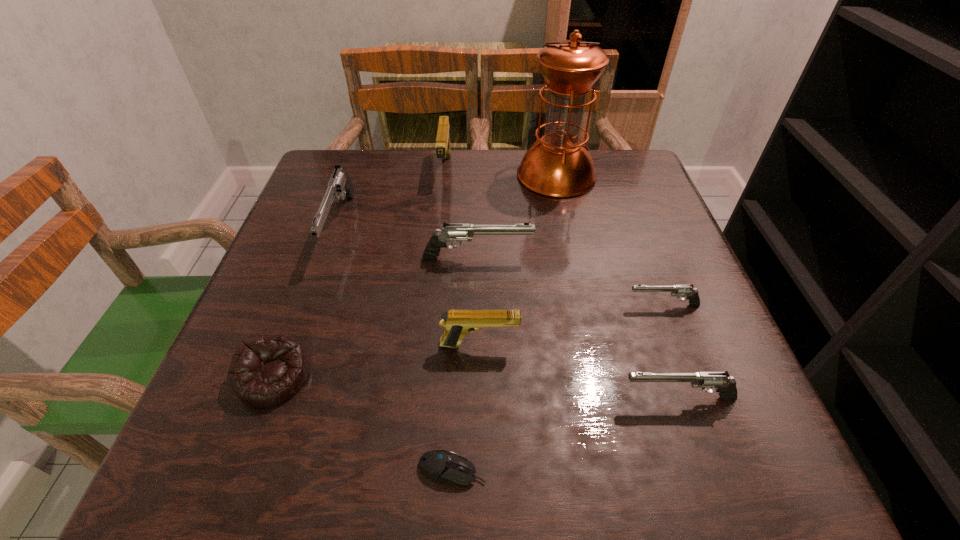
The width and height of the screenshot is (960, 540). I want to click on the third nearest pistol, so (676, 290).

I want to click on the fifth farthest object, so click(x=676, y=290).

The image size is (960, 540). Find the location of `beanbag`. beanbag is located at coordinates (267, 370).

Find the location of a particular element. This screenshot has height=540, width=960. the shortest object is located at coordinates (439, 465).

Identify the location of computer mouse. (439, 465).

Locate an element on the screen. This screenshot has height=540, width=960. vacant space located on the left of the tallest object is located at coordinates (430, 175).

Image resolution: width=960 pixels, height=540 pixels. Find the location of `vacant space located 0.400m at the barrel of the bigger tan pistol`. vacant space located 0.400m at the barrel of the bigger tan pistol is located at coordinates (430, 316).

Image resolution: width=960 pixels, height=540 pixels. I want to click on free space located 0.230m on the front-facing side of the biggest silver pistol, so click(x=292, y=368).

The image size is (960, 540). I want to click on free point located 0.280m on the front-facing side of the third smallest silver pistol, so click(668, 258).

I want to click on vacant space located at the barrel of the nearer tan pistol, so pyautogui.click(x=670, y=345).